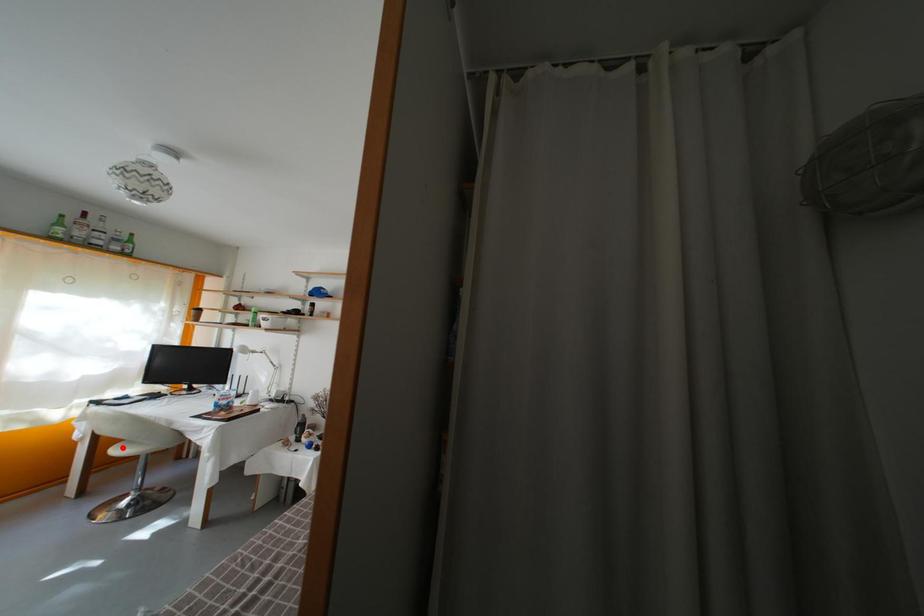
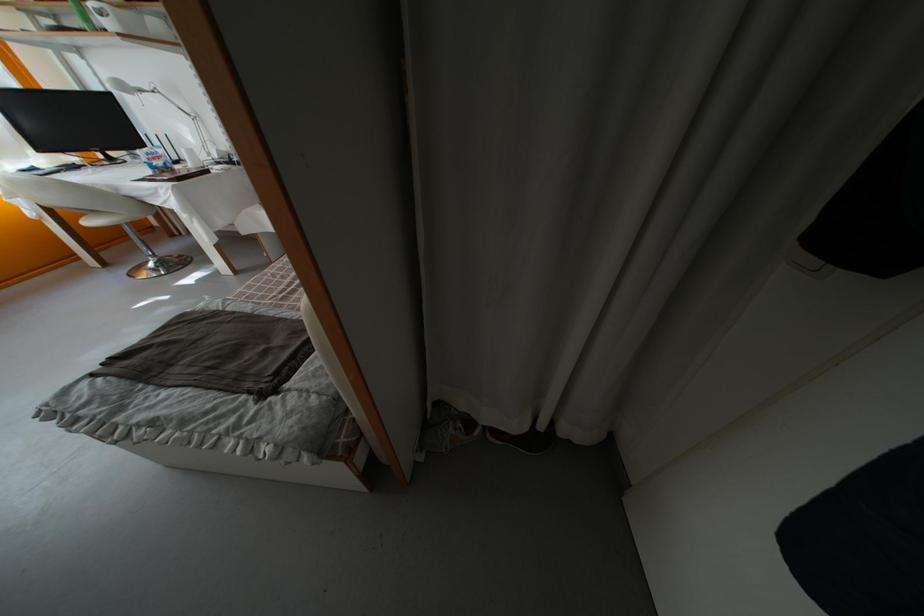
In the second image, find the point that corresponds to the highlighted location in the first image.

(84, 221)